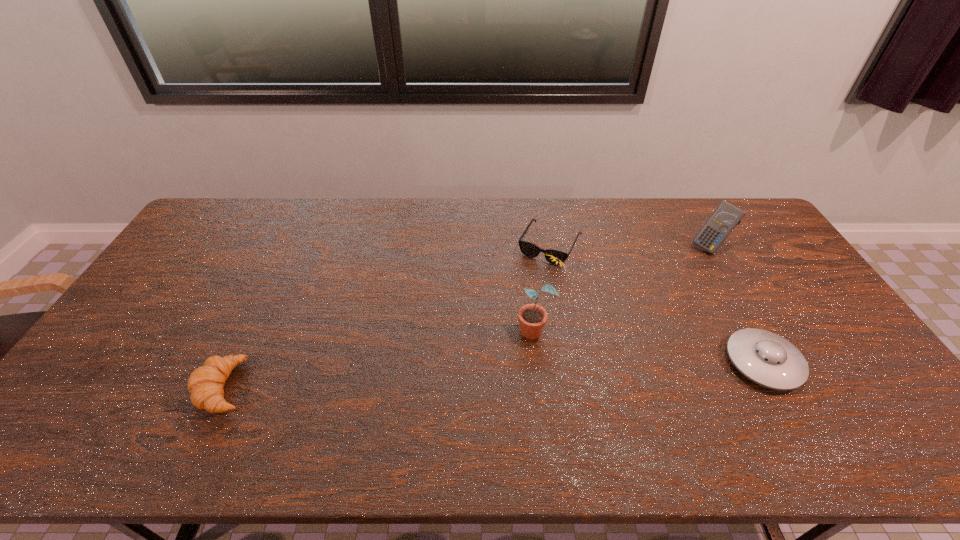
Find the location of a particular element. vacant space located on the flower of the sunflower is located at coordinates (468, 368).

Find the location of a particular element. This screenshot has height=540, width=960. free space located on the flower of the sunflower is located at coordinates (451, 377).

This screenshot has height=540, width=960. I want to click on vacant space located 0.230m on the flower of the sunflower, so click(x=451, y=377).

This screenshot has height=540, width=960. Find the location of `free space located on the front-facing side of the calculator`. free space located on the front-facing side of the calculator is located at coordinates (691, 260).

This screenshot has height=540, width=960. Find the location of `vacant area located on the front-facing side of the calculator`. vacant area located on the front-facing side of the calculator is located at coordinates (662, 286).

I want to click on free point located 0.360m on the front-facing side of the calculator, so click(638, 307).

Locate an element on the screen. This screenshot has height=540, width=960. sunglasses that is at the far edge is located at coordinates (529, 249).

This screenshot has width=960, height=540. Identify the location of calculator that is at the far edge. (723, 220).

Find the location of a particular element. This screenshot has width=960, height=540. crescent roll that is at the near edge is located at coordinates coord(205,384).

Locate an element on the screen. Image resolution: width=960 pixels, height=540 pixels. saucer that is positioned at the near edge is located at coordinates [766, 358].